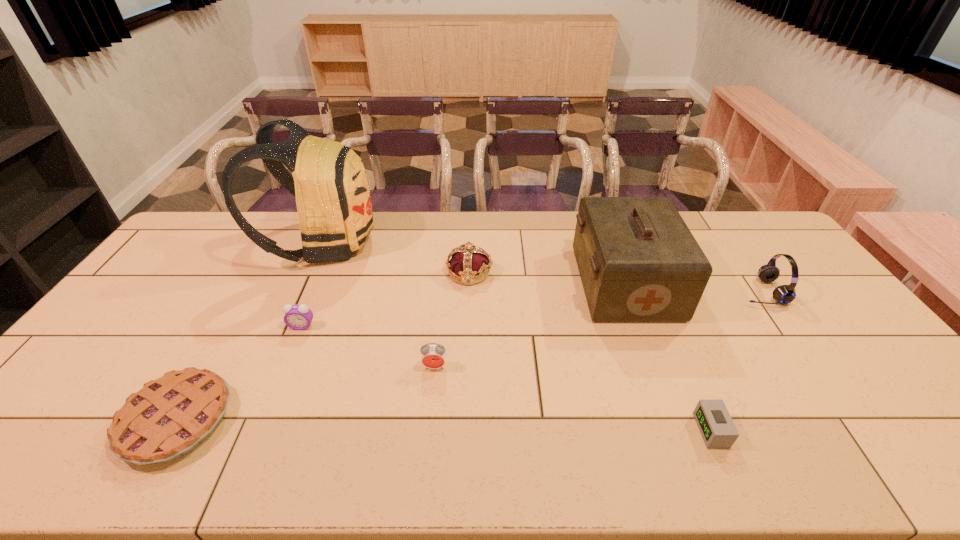
Locate an element on the screen. This screenshot has height=540, width=960. pie is located at coordinates (169, 417).

You are a GUI agent. You are given a task and a screenshot of the screen. Output one action in this format:
    pyautogui.click(x=<x>, y=<y>)
    Task: Click on the free location located 0.230m on the front-facing side of the tallest object
    
    Given the screenshot: What is the action you would take?
    pyautogui.click(x=443, y=242)

I want to click on free spot located on the front of the first-aid kit, so click(658, 372).

The image size is (960, 540). Find the location of `blank space located 0.300m on the ear cushions of the headset`. blank space located 0.300m on the ear cushions of the headset is located at coordinates (643, 292).

Image resolution: width=960 pixels, height=540 pixels. Identify the location of vacant space located on the ear cushions of the headset. (694, 292).

Where is `vacant space situated on the ear cushions of the headset`? vacant space situated on the ear cushions of the headset is located at coordinates (624, 292).

Locate an element on the screen. The height and width of the screenshot is (540, 960). free space located on the right of the crown is located at coordinates (547, 273).

At what (x,y) coordinates should I click in order to perform the action: click on free region located on the face of the tallest alarm clock. Please return your answer as a coordinate pair (x, y). This screenshot has height=540, width=960. Looking at the image, I should click on (428, 436).

At what (x,y) coordinates should I click in order to perform the action: click on vacant space located on the face of the farthest alarm clock. Please return your answer as a coordinate pair (x, y). This screenshot has height=540, width=960. Looking at the image, I should click on (252, 446).

Identify the location of free region located 0.090m on the front-facing side of the rightmost alarm clock. This screenshot has width=960, height=540. (660, 430).